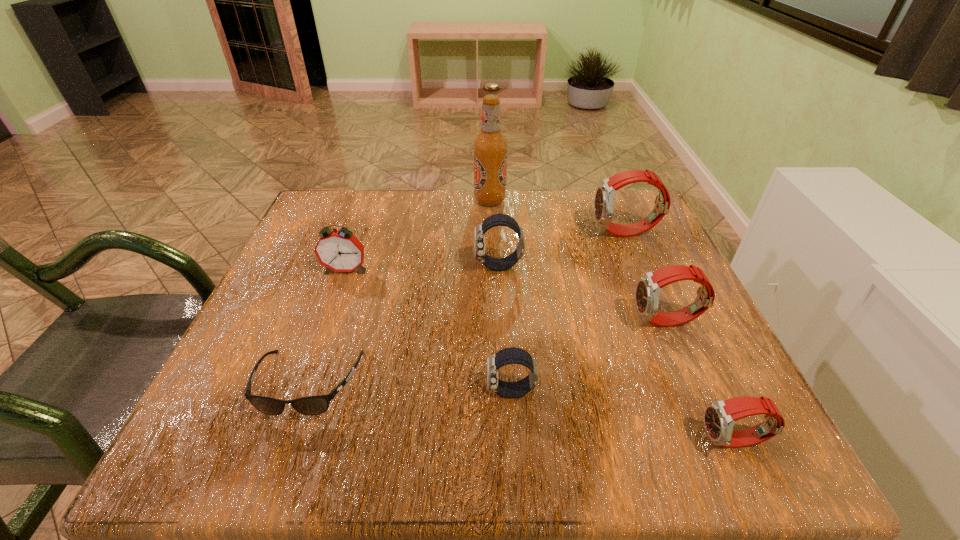
Identify the location of free space located 0.250m on the face of the second nearest watch. (327, 392).

The width and height of the screenshot is (960, 540). Identify the location of blank space located on the face of the smallest red watch. (633, 442).

This screenshot has width=960, height=540. I want to click on free space located 0.390m on the face of the smallest red watch, so click(x=430, y=442).

Where is `vacant space located 0.280m on the face of the smallest red watch`? The width and height of the screenshot is (960, 540). vacant space located 0.280m on the face of the smallest red watch is located at coordinates (507, 442).

Where is `beer bottle located in the far edge section of the desktop`? beer bottle located in the far edge section of the desktop is located at coordinates [x=490, y=146].

Where is `watch present at the far edge`? watch present at the far edge is located at coordinates (605, 194).

The height and width of the screenshot is (540, 960). Identify the location of watch that is at the near edge. (720, 416).

Locate an element on the screen. sunglasses present at the near edge is located at coordinates (312, 405).

This screenshot has height=540, width=960. In order to click on alarm clock at the left edge in this screenshot , I will do `click(339, 250)`.

The width and height of the screenshot is (960, 540). Find the location of `sunglasses present at the left edge`. sunglasses present at the left edge is located at coordinates (312, 405).